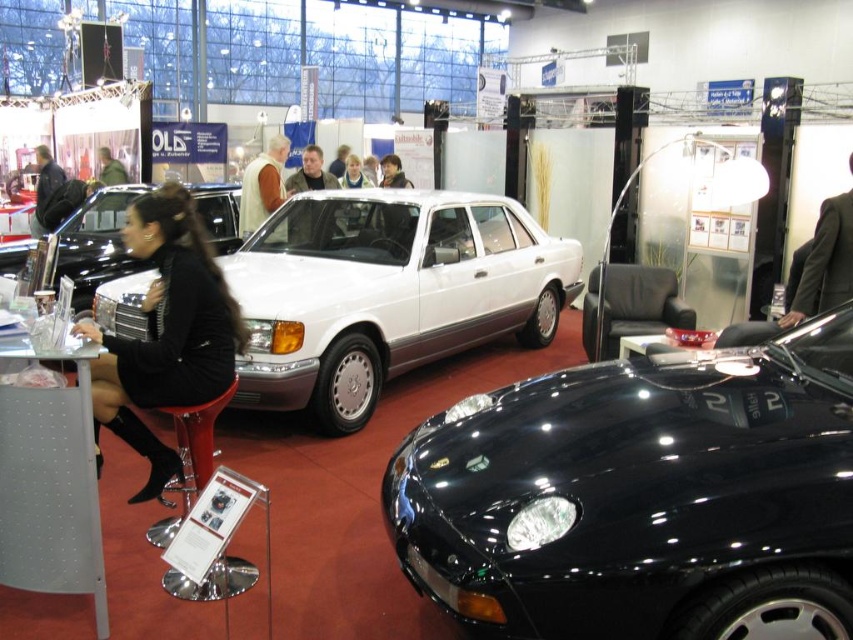
You are a photographer at the car exhibition. You need to capture a photo that includes both the white metallic sedan at center and the black fabric dress at lower left. Based on their positions, which object should be placed closer to the camera to ensure both are in frame without cropping?

The white metallic sedan at center should be placed closer to the camera because it is wider than the black fabric dress at lower left, ensuring both fit within the frame when positioned appropriately.

From the picture: You are a photographer at the car exhibition. You want to take a photo of the white metallic sedan at center without any people or objects blocking it. Is the black fabric dress at lower left currently blocking your view of the sedan?

The black fabric dress at lower left is behind the white metallic sedan at center, so it is not blocking the view of the sedan. You can take the photo without any obstruction.